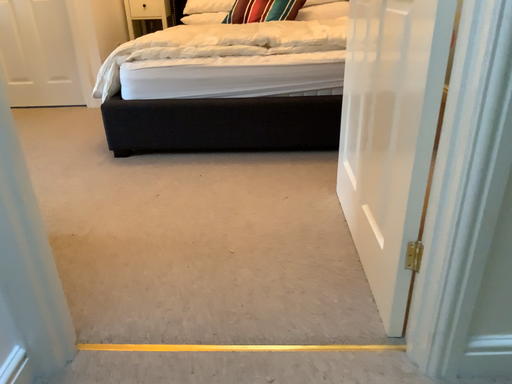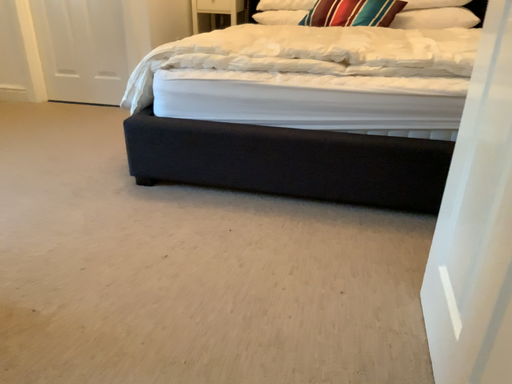
Question: How did the camera likely rotate when shooting the video?

Choices:
 (A) rotated left
 (B) rotated right

Answer: (A)